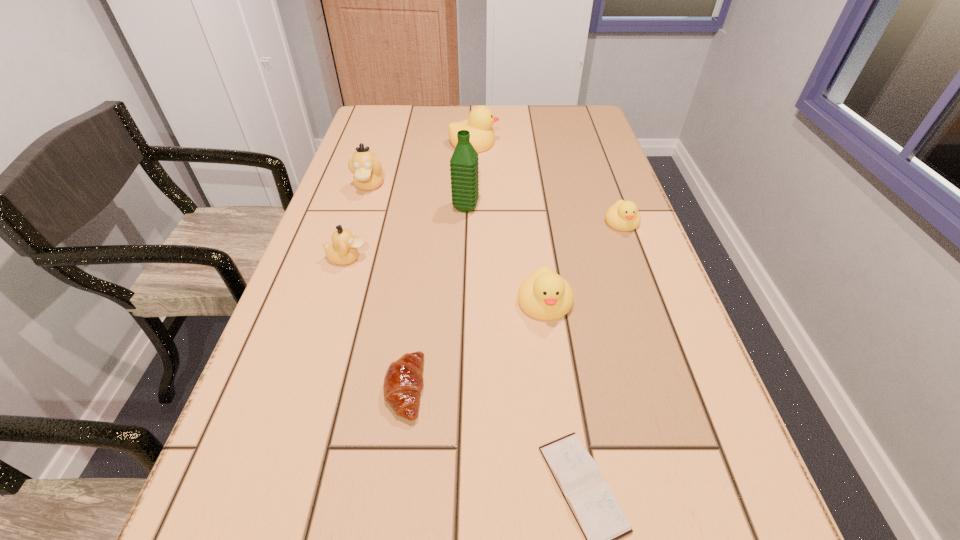
The width and height of the screenshot is (960, 540). Identify the location of the tallest object. (464, 163).

Locate an element on the screen. green water bottle is located at coordinates (464, 163).

The image size is (960, 540). Find the location of `the farther tan duckling`. the farther tan duckling is located at coordinates (368, 175).

Image resolution: width=960 pixels, height=540 pixels. I want to click on the second farthest object, so click(x=368, y=175).

Where is `the farthest object`? the farthest object is located at coordinates (481, 118).

This screenshot has width=960, height=540. I want to click on the farthest duckling, so click(x=481, y=118).

Locate an element on the screen. The height and width of the screenshot is (540, 960). the second biggest yellow duckling is located at coordinates (544, 295).

Locate an element on the screen. the third nearest object is located at coordinates (544, 295).

This screenshot has height=540, width=960. In order to click on the fourth farthest duckling in this screenshot , I will do `click(343, 250)`.

The height and width of the screenshot is (540, 960). I want to click on the nearer tan duckling, so click(343, 250).